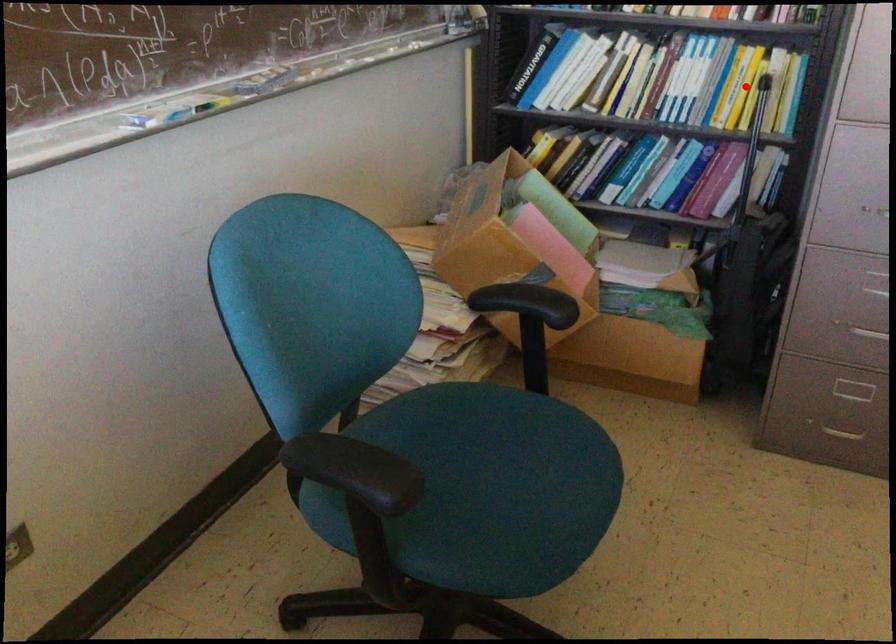
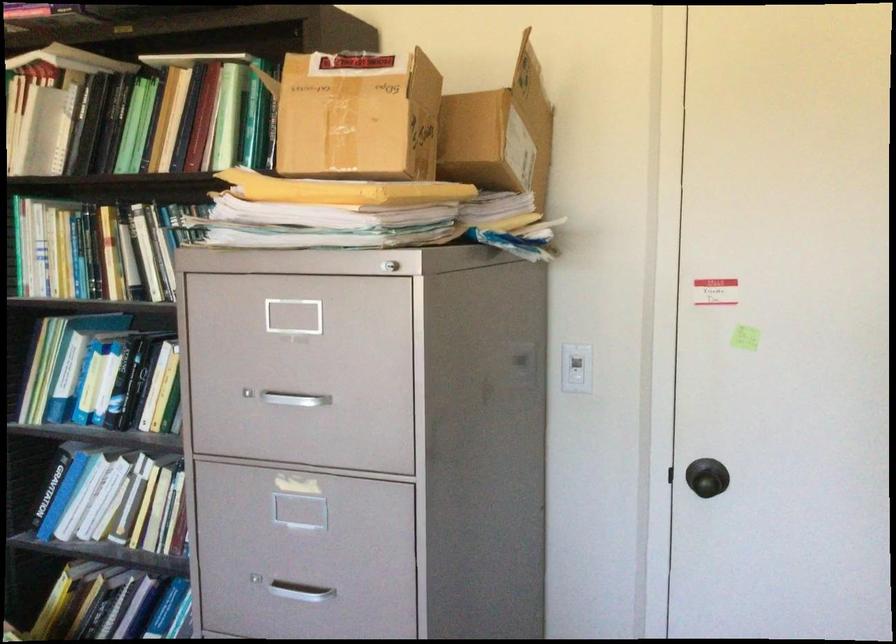
Question: I am providing you with two images of the same scene from different viewpoints. A red point is marked on the first image. Can you still see the location of the red point in image 2?

Choices:
 (A) Yes
 (B) No

Answer: (B)